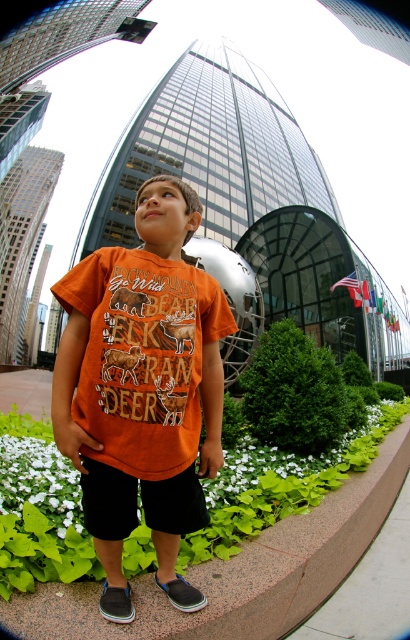
Between orange cotton shirt at center and black cotton shorts at center, which one appears on the left side from the viewer's perspective?

orange cotton shirt at center

Who is more distant from viewer, (143, 432) or (136, 480)?

Positioned behind is point (136, 480).

Describe the element at coordinates (141, 388) in the screenshot. Image resolution: width=410 pixels, height=640 pixels. I see `orange cotton shirt at center` at that location.

The width and height of the screenshot is (410, 640). What are the coordinates of `orange cotton shirt at center` in the screenshot? It's located at (141, 388).

Is the position of orange cotton shirt at center less distant than that of granite ledge at lower center?

Yes, it is in front of granite ledge at lower center.

Between point (207, 378) and point (0, 628), which one is positioned behind?

Point (207, 378)

Between point (189, 285) and point (243, 531), which one is positioned behind?

The point (243, 531) is behind.

Locate an element on the screen. orange cotton shirt at center is located at coordinates click(x=141, y=388).

Is granite ledge at lower center to the left of black cotton shorts at center from the viewer's perspective?

In fact, granite ledge at lower center is to the right of black cotton shorts at center.

Which is above, granite ledge at lower center or black cotton shorts at center?

black cotton shorts at center is higher up.

Is point (227, 506) less distant than point (90, 483)?

No.

Locate an element on the screen. granite ledge at lower center is located at coordinates (284, 493).